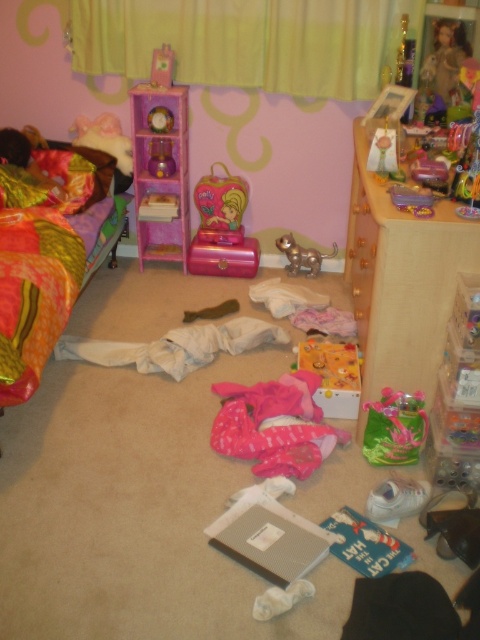
Question: Which point is closer to the camera taking this photo?

Choices:
 (A) (160, 170)
 (B) (312, 260)
 (C) (203, 4)

Answer: (C)

Question: Is pink fabric at center thinner than multicolored quilted bed at left?

Choices:
 (A) no
 (B) yes

Answer: (B)

Question: Which object is positioned farthest from the pink fabric at center?

Choices:
 (A) matte purple clock at center
 (B) yellow fabric curtain at upper center

Answer: (B)

Question: Which point is closer to the camera?

Choices:
 (A) (356, 413)
 (B) (32, 316)
 (C) (208, 196)

Answer: (B)

Question: Does shiny green plastic toy at center appear under metallic silver cat at center?

Choices:
 (A) yes
 (B) no

Answer: (A)

Question: Does shiny green plastic toy at center have a lesser width compared to yellow plastic toy at center?

Choices:
 (A) no
 (B) yes

Answer: (B)